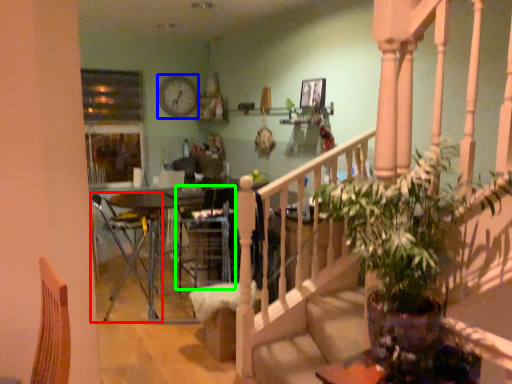
Question: Which object is the farthest from chair (highlighted by a red box)? Choose among these: clock (highlighted by a blue box) or armchair (highlighted by a green box).

Choices:
 (A) clock
 (B) armchair

Answer: (A)